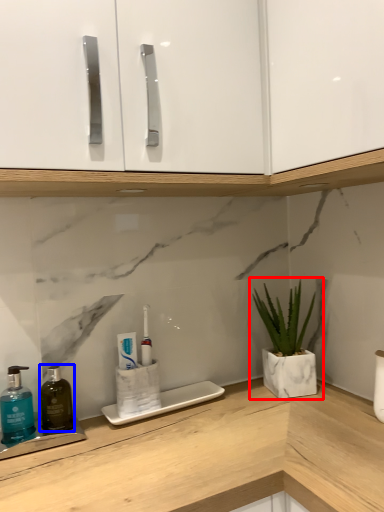
Question: Among these objects, which one is nearest to the camera, houseplant (highlighted by a red box) or mouthwash (highlighted by a blue box)?

Choices:
 (A) houseplant
 (B) mouthwash

Answer: (B)